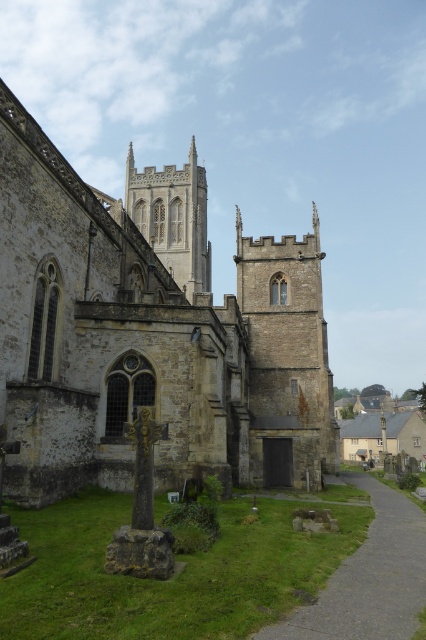
You are standing at the entrance of the historic stone church and want to walk to the stone spire at center. Which direction should you head from the brown gravel path at lower center?

The brown gravel path at lower center is to the right of the stone spire at center, so to reach the stone spire at center, you should head to the left from the brown gravel path at lower center.

You are standing in front of the historic stone church and want to take a photo that includes both the stone church at center and the stone spire at center. Given that your camera has a maximum focus range of 7 meters, will you be able to capture both objects in focus without moving your position?

The stone church at center is 6.92 meters away from the stone spire at center. Since the distance between them is within the camera maximum focus range of 7 meters, you can capture both objects in focus without moving your position.